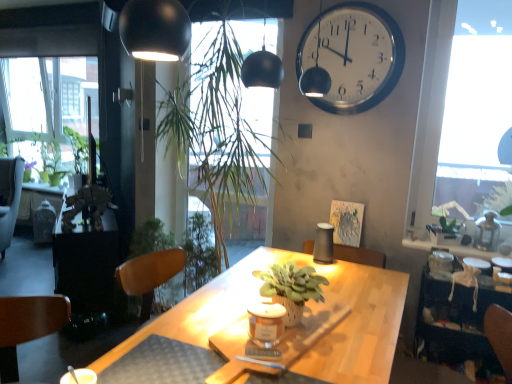
Question: From a real-world perspective, is velvet brown armchair at left physically located above or below green matte plant at upper right, the 2th plant viewed from the back?

Choices:
 (A) below
 (B) above

Answer: (A)

Question: Considering the positions of point (12, 215) and point (460, 228), is point (12, 215) closer or farther from the camera than point (460, 228)?

Choices:
 (A) farther
 (B) closer

Answer: (A)

Question: Which is nearer to the green matte plant at left, which appears as the 1th plant when viewed from the left?

Choices:
 (A) green matte plant at upper right, marked as the 1th plant in a right-to-left arrangement
 (B) transparent glass window at upper right
 (C) white glossy clock at upper right
 (D) green matte plant at center
 (E) matte glass candle at center

Answer: (C)

Question: Considering the real-world distances, which object is farthest from the white glossy clock at upper right?

Choices:
 (A) green leafy plant at center, arranged as the 3th plant when viewed from the back
 (B) velvet brown armchair at left
 (C) green matte plant at upper right, the 3th plant when ordered from left to right
 (D) green matte plant at center
 (E) metallic brown table at left, which is the first table in back-to-front order

Answer: (B)